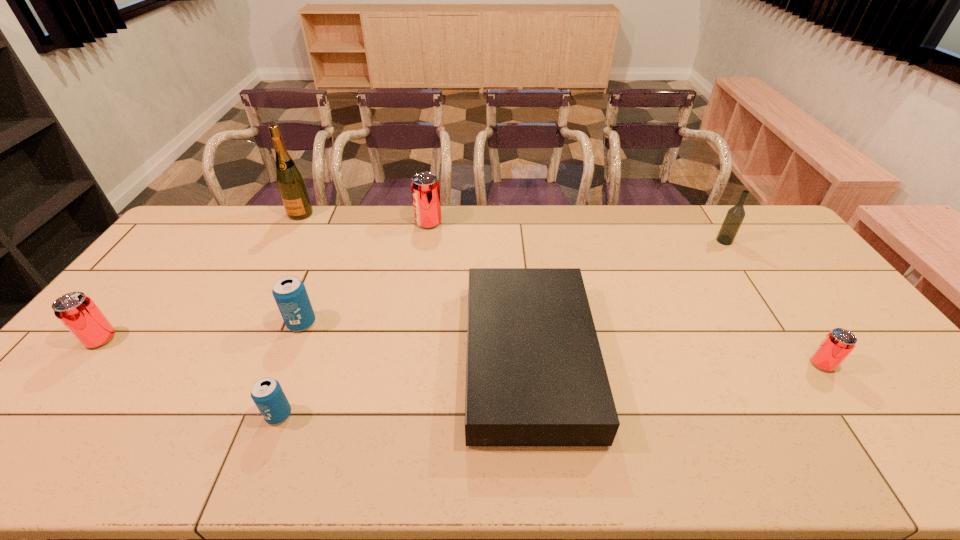
Where is `free space between the black vodka and the fifth object from left to right`? free space between the black vodka and the fifth object from left to right is located at coordinates (576, 232).

I want to click on free space between the sixth nearest object and the leftmost red soda can, so click(x=413, y=290).

You are a GUI agent. You are given a task and a screenshot of the screen. Output one action in this format:
    pyautogui.click(x=<x>, y=<y>)
    Task: Click on the object that is the second closest to the farther blue soda can
    The image size is (960, 540).
    Given the screenshot: What is the action you would take?
    pyautogui.click(x=535, y=376)

Where is `object identified as the fifth closest to the black vodka`? The image size is (960, 540). object identified as the fifth closest to the black vodka is located at coordinates (267, 393).

Identify the location of soda can that can be found as the closest to the shortest object. The image size is (960, 540). (425, 188).

Locate which soda can ranks in proximity to the second smallest red soda can. Please provide its 2D coordinates. Your answer should be formatted as a tuple, i.e. [(x, y)], where the tuple contains the x and y coordinates of a point satisfying the conditions above.

[(289, 292)]

In order to click on red soda can that is the closest to the seventh object from right to left in this screenshot , I will do `click(425, 188)`.

The height and width of the screenshot is (540, 960). What are the coordinates of `red soda can that is the nearest to the farther blue soda can` in the screenshot? It's located at (76, 311).

The image size is (960, 540). What are the coordinates of `vacant region that satisfies the following two spatial constraints: 1. on the front-facing side of the rightmost red soda can; 2. on the right side of the second object from left to right` in the screenshot? It's located at (220, 364).

You are a GUI agent. You are given a task and a screenshot of the screen. Output one action in this format:
    pyautogui.click(x=<x>, y=<y>)
    Task: Click on the vacant space that satisfies the following two spatial constraints: 1. on the front side of the nearest soda can; 2. on the left side of the second farthest red soda can
    This screenshot has width=960, height=540.
    Given the screenshot: What is the action you would take?
    pyautogui.click(x=38, y=415)